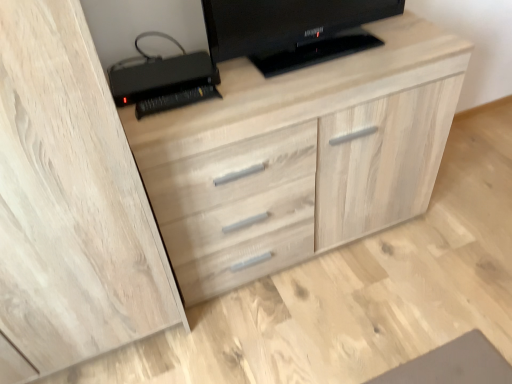
Question: Is black glossy television at upper center spatially inside light wood dresser at center, or outside of it?

Choices:
 (A) outside
 (B) inside

Answer: (A)

Question: Is black glossy television at upper center wider or thinner than light wood dresser at center?

Choices:
 (A) thin
 (B) wide

Answer: (A)

Question: Considering the real-world distances, which object is closest to the light wood dresser at center?

Choices:
 (A) black plastic printer at upper left
 (B) black glossy television at upper center

Answer: (B)

Question: Which of these objects is positioned closest to the black plastic printer at upper left?

Choices:
 (A) black glossy television at upper center
 (B) light wood dresser at center

Answer: (A)